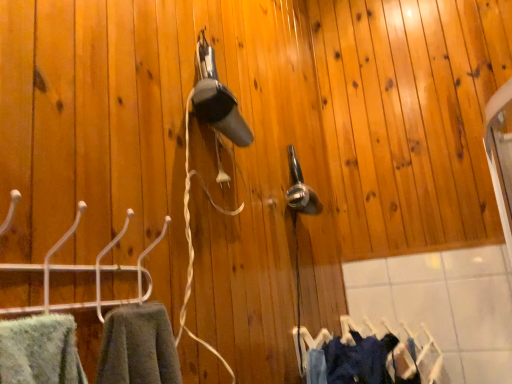
Question: Is white plastic hanger at left taller than denim fabric clothes at lower right?

Choices:
 (A) no
 (B) yes

Answer: (A)

Question: Does white plastic hanger at left have a larger size compared to denim fabric clothes at lower right?

Choices:
 (A) yes
 (B) no

Answer: (B)

Question: Is white plastic hanger at left outside denim fabric clothes at lower right?

Choices:
 (A) no
 (B) yes

Answer: (B)

Question: From a real-world perspective, is white plastic hanger at left positioned over denim fabric clothes at lower right based on gravity?

Choices:
 (A) yes
 (B) no

Answer: (A)

Question: Is white plastic hanger at left positioned with its back to denim fabric clothes at lower right?

Choices:
 (A) no
 (B) yes

Answer: (A)

Question: Based on their positions, is white plastic hanger at left located to the left or right of dark blue fabric at lower right?

Choices:
 (A) left
 (B) right

Answer: (A)

Question: From their relative heights in the image, would you say white plastic hanger at left is taller or shorter than dark blue fabric at lower right?

Choices:
 (A) tall
 (B) short

Answer: (B)

Question: From the image's perspective, is white plastic hanger at left above or below dark blue fabric at lower right?

Choices:
 (A) above
 (B) below

Answer: (A)

Question: From a real-world perspective, is white plastic hanger at left physically located above or below dark blue fabric at lower right?

Choices:
 (A) below
 (B) above

Answer: (B)

Question: Considering the positions of white plastic hanger at left and denim fabric clothes at lower right in the image, is white plastic hanger at left taller or shorter than denim fabric clothes at lower right?

Choices:
 (A) tall
 (B) short

Answer: (B)

Question: Considering the relative positions of white plastic hanger at left and denim fabric clothes at lower right in the image provided, is white plastic hanger at left to the left or to the right of denim fabric clothes at lower right?

Choices:
 (A) left
 (B) right

Answer: (A)

Question: In terms of size, does white plastic hanger at left appear bigger or smaller than denim fabric clothes at lower right?

Choices:
 (A) small
 (B) big

Answer: (A)

Question: From the image's perspective, is white plastic hanger at left above or below denim fabric clothes at lower right?

Choices:
 (A) above
 (B) below

Answer: (A)

Question: Does point (413, 354) appear closer or farther from the camera than point (355, 380)?

Choices:
 (A) closer
 (B) farther

Answer: (B)

Question: From the image's perspective, is denim fabric clothes at lower right above or below dark blue fabric at lower right?

Choices:
 (A) below
 (B) above

Answer: (A)